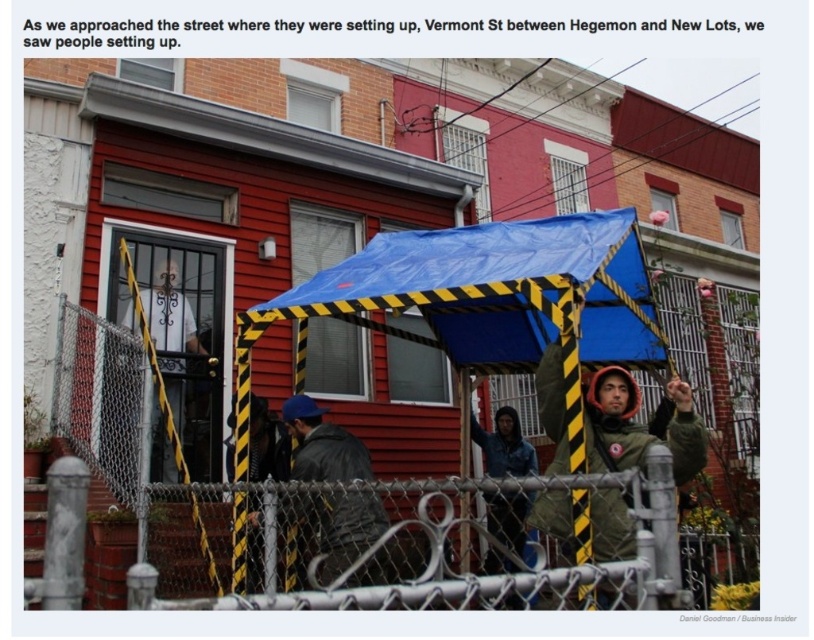
Who is lower down, green matte jacket at center or denim jacket at center?

denim jacket at center

Is green matte jacket at center above denim jacket at center?

Yes, green matte jacket at center is above denim jacket at center.

Describe the element at coordinates (637, 426) in the screenshot. I see `green matte jacket at center` at that location.

Where is `green matte jacket at center`? green matte jacket at center is located at coordinates (637, 426).

Consider the image. Is metal chain-link fence at center taller than green matte jacket at center?

Yes, metal chain-link fence at center is taller than green matte jacket at center.

Between metal chain-link fence at center and green matte jacket at center, which one has more height?

A: Standing taller between the two is metal chain-link fence at center.

Is point (470, 524) positioned in front of point (641, 433)?

Yes, point (470, 524) is closer to viewer.

The image size is (814, 640). Find the location of `metal chain-link fence at center`. metal chain-link fence at center is located at coordinates (348, 536).

Is the position of metal chain-link fence at center more distant than that of dark gray leather jacket at center?

No, metal chain-link fence at center is in front of dark gray leather jacket at center.

From the picture: Who is more forward, (327, 481) or (335, 448)?

Positioned in front is point (327, 481).

I want to click on metal chain-link fence at center, so click(348, 536).